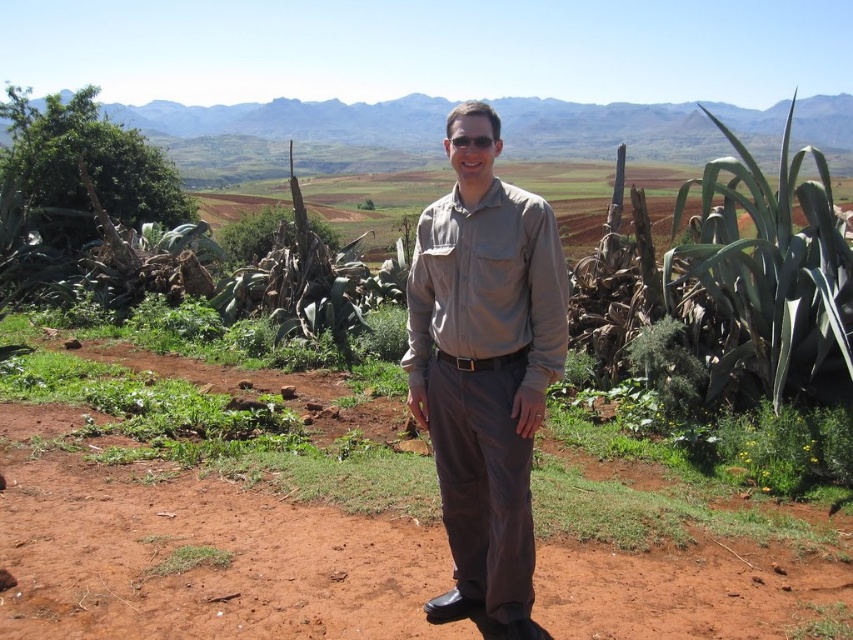
Question: Is matte khaki shirt at center positioned before green grass at lower left?

Choices:
 (A) no
 (B) yes

Answer: (B)

Question: Is matte khaki shirt at center to the left of green grass at lower left from the viewer's perspective?

Choices:
 (A) no
 (B) yes

Answer: (A)

Question: Is matte khaki shirt at center thinner than green grass at lower left?

Choices:
 (A) yes
 (B) no

Answer: (B)

Question: Which of the following is the closest to the observer?

Choices:
 (A) (207, 564)
 (B) (445, 422)

Answer: (B)

Question: Which point is farther from the camera taking this photo?

Choices:
 (A) (527, 531)
 (B) (164, 566)

Answer: (B)